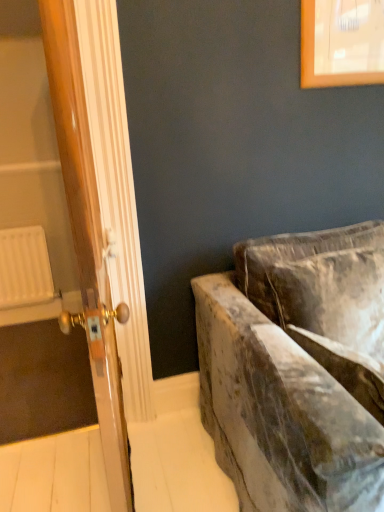
I want to click on free space in front of wooden door at left, so click(x=60, y=475).